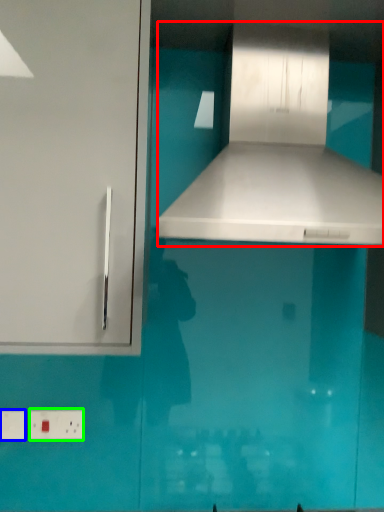
Question: Which object is the closest to the vent (highlighted by a red box)? Choose among these: electric outlet (highlighted by a blue box) or electric outlet (highlighted by a green box).

Choices:
 (A) electric outlet
 (B) electric outlet

Answer: (B)